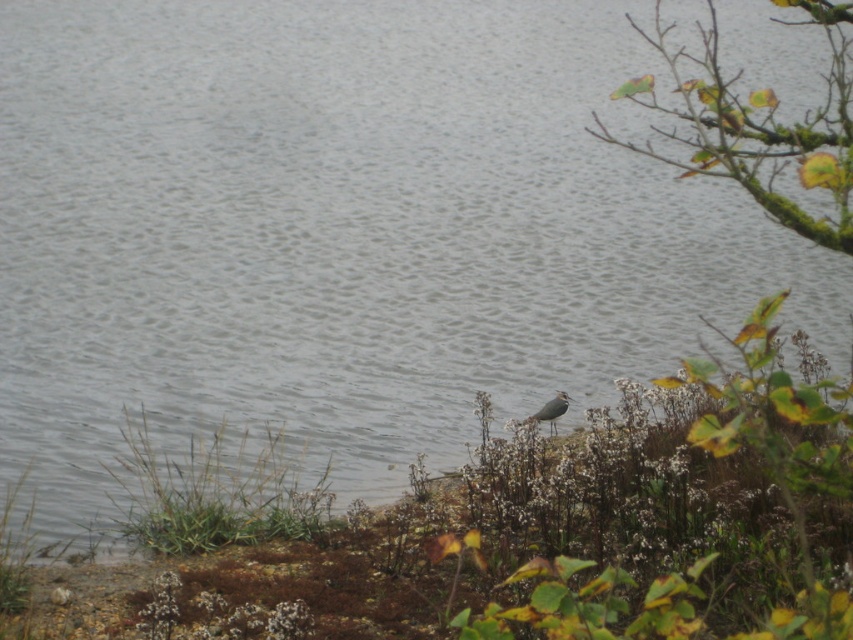
You are a painter standing at the lakeside and want to paint the green mossy branch at upper right. Based on its coordinates, where should you look to capture its position accurately?

The green mossy branch at upper right is located at coordinates point (x=759, y=124), so you should look towards the upper right area of the scene to capture its position accurately.